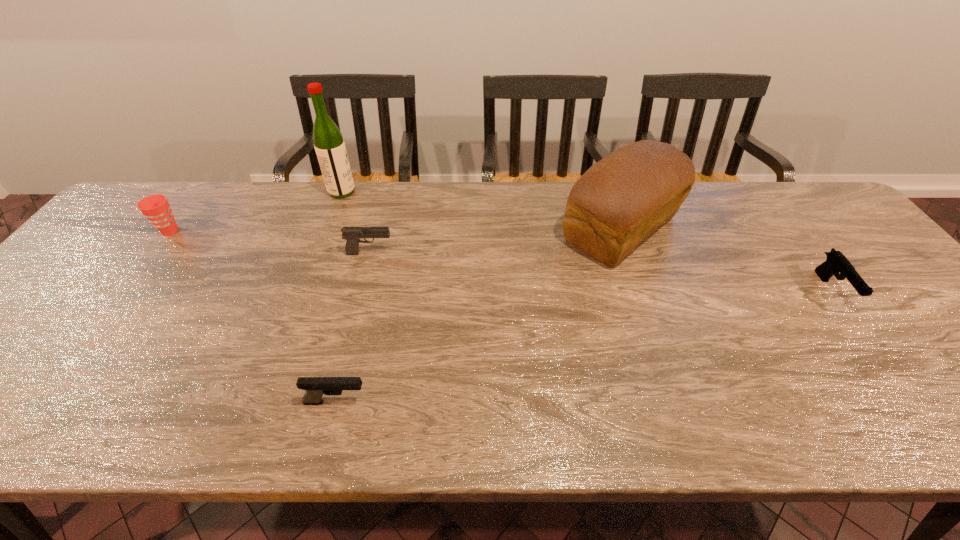
Image resolution: width=960 pixels, height=540 pixels. In order to click on object that is at the far left corner in this screenshot , I will do `click(156, 208)`.

Find the location of `vacant space at the far edge of the desktop`. vacant space at the far edge of the desktop is located at coordinates (389, 191).

Locate an element on the screen. This screenshot has width=960, height=540. free point at the near edge is located at coordinates (145, 435).

Where is `blank area at the left edge`? The image size is (960, 540). blank area at the left edge is located at coordinates (79, 265).

Identify the location of vacant space at the far left corner of the desktop. (x=174, y=183).

This screenshot has width=960, height=540. What are the coordinates of `vacant space that's between the rightmost object and the nearest pistol` in the screenshot? It's located at (584, 346).

Find the location of a particular element. Image resolution: width=960 pixels, height=540 pixels. unoccupied position between the nearest object and the rightmost object is located at coordinates (584, 346).

This screenshot has width=960, height=540. In order to click on vacant space in between the second nearest pistol and the farthest pistol in this screenshot , I will do `click(601, 272)`.

Locate an element on the screen. vacant space in between the farthest pistol and the second object from right to left is located at coordinates (495, 241).

Where is `vacant area between the fifth object from right to left and the nearest pistol`? This screenshot has height=540, width=960. vacant area between the fifth object from right to left and the nearest pistol is located at coordinates (339, 297).